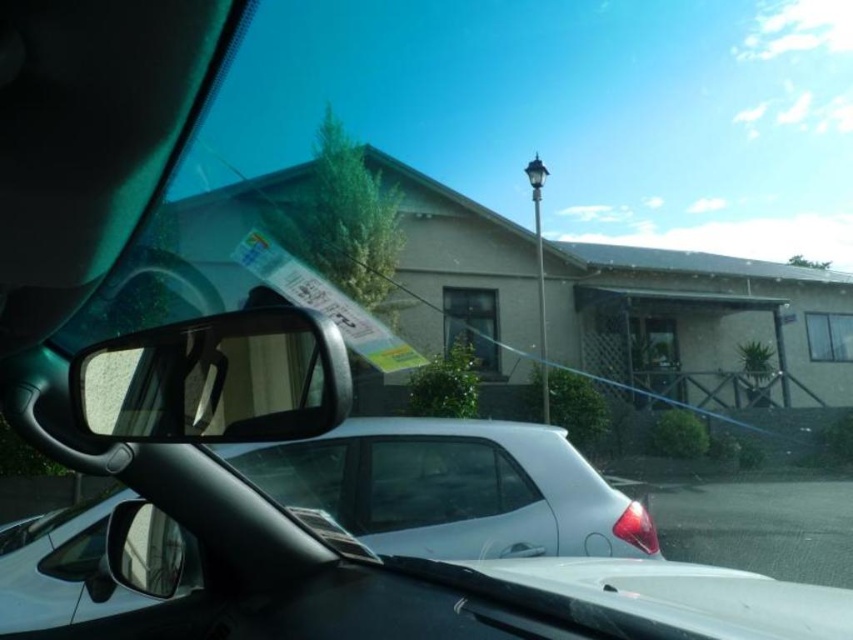
You are inside a car and looking out through the windshield. You see a point marked at coordinates (453, 488). What object is located at that point?

The point at coordinates (453, 488) is where the white glossy car at center is located.

What are the coordinates of the white glossy car at center?

The white glossy car at center is located at coordinates point (x=453, y=488).

You are sitting in the driver seat of the car. You want to check the traffic behind you. Which object at point (x=216, y=380) can you use to see the traffic behind you?

The transparent plastic view mirror at left located at point (x=216, y=380) can be used to check the traffic behind you.